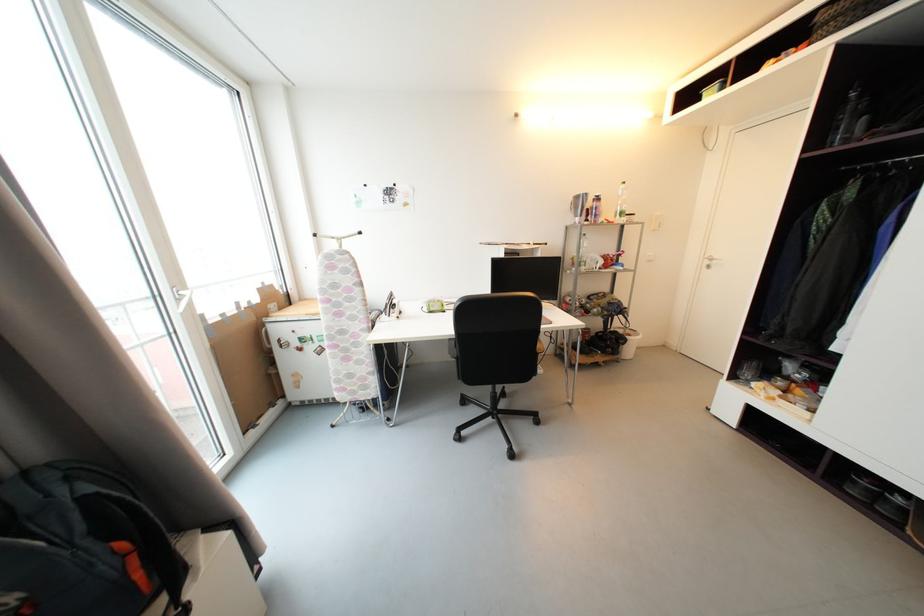
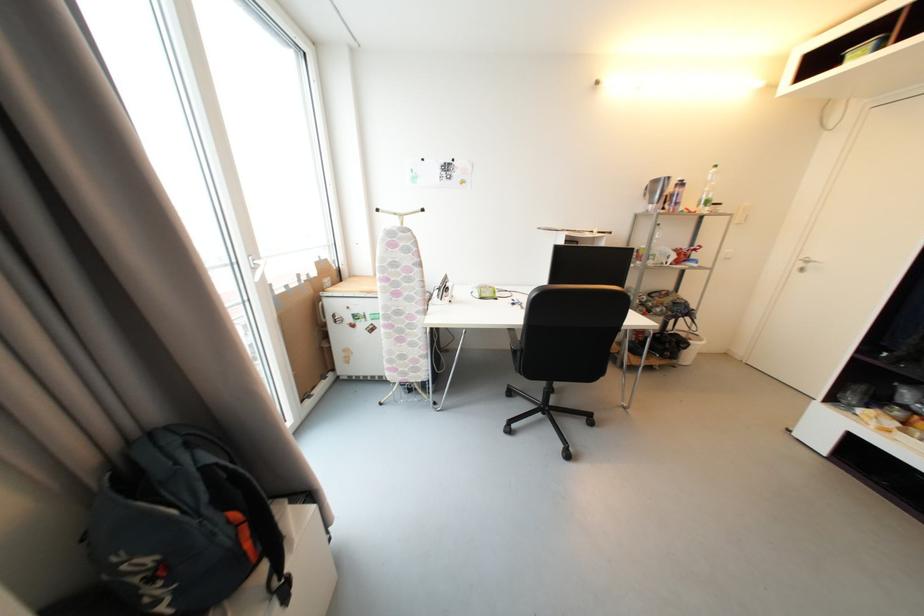
Locate, in the second image, the point that corresponds to point (711, 264) in the first image.

(806, 267)